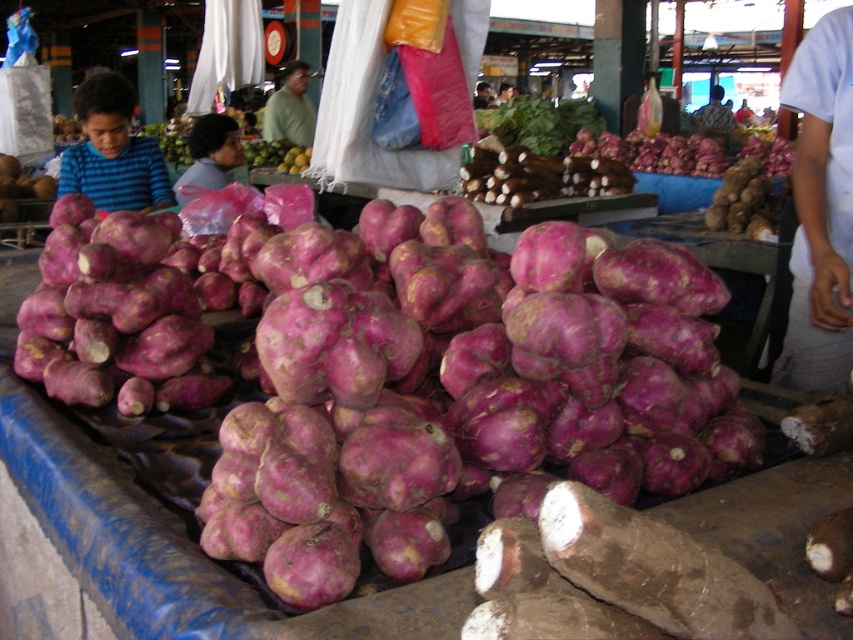
You are a customer at the market and you want to buy both the green matte shirt at center and the green matte mango at center. If you place them side by side on the table, which one will take up more space?

The green matte shirt at center is bigger than the green matte mango at center, so it will take up more space when placed side by side on the table.

You are a customer at the market and want to buy both the purple matte onion at upper center and the striped shirt at center. Since you can only reach one item at a time, which item should you reach for first to grab the one closer to your left?

The purple matte onion at upper center is positioned on the left side of striped shirt at center, so you should reach for the purple matte onion at upper center first as it is closer to your left.

You are a customer at the market and want to buy the purple matte root at center. The vendor is at the point with coordinates (540,122). Where should you go to find the purple matte root at center?

The purple matte root at center is located at the point with coordinates (540,122), so you should go to that point to find it.